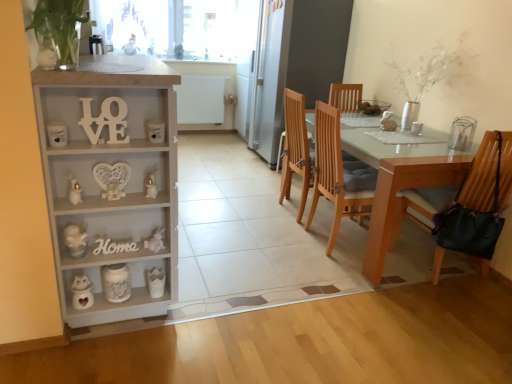
I want to click on leather-like black bag at right, the first chair viewed from the front, so click(405, 200).

Locate an element on the screen. This screenshot has height=384, width=512. wooden sign at lower left, the 1th number from the back is located at coordinates (114, 246).

In order to face white glass vase at upper right, should I rotate leftwards or rightwards?

Rotate your view right by about 20.714°.

This screenshot has height=384, width=512. I want to click on white wood love at left, which ranks as the first number in front-to-back order, so click(x=105, y=120).

You are a GUI agent. You are given a task and a screenshot of the screen. Output one action in this format:
    pyautogui.click(x=<x>, y=<y>)
    Task: Click on the leather-like black bag at right, which ranks as the 1th chair in right-to-left order
    
    Given the screenshot: What is the action you would take?
    pyautogui.click(x=405, y=200)

Looking at this image, how different are the orientations of transparent glass window screen at upper center and light brown wood chair at center, placed as the second chair when sorted from right to left, in degrees?

transparent glass window screen at upper center and light brown wood chair at center, placed as the second chair when sorted from right to left, are facing 91.1 degrees away from each other.

You are a GUI agent. You are given a task and a screenshot of the screen. Output one action in this format:
    pyautogui.click(x=<x>, y=<y>)
    Task: Click on the window screen behind the light brown wood chair at center, placed as the second chair when sorted from right to left
    
    Given the screenshot: What is the action you would take?
    pyautogui.click(x=176, y=26)

From the image's perspective, which one is positioned higher, transparent glass window screen at upper center or light brown wood chair at center, placed as the second chair when sorted from right to left?

transparent glass window screen at upper center is shown above in the image.

Considering the sizes of objects transparent glass window screen at upper center and light brown wood chair at center, placed as the second chair when sorted from right to left, in the image provided, who is wider, transparent glass window screen at upper center or light brown wood chair at center, placed as the second chair when sorted from right to left,?

light brown wood chair at center, placed as the second chair when sorted from right to left.

Does white glass vase at upper right appear on the left side of transparent glass window screen at upper center?

Incorrect, white glass vase at upper right is not on the left side of transparent glass window screen at upper center.

Considering the relative sizes of white glass vase at upper right and transparent glass window screen at upper center in the image provided, is white glass vase at upper right thinner than transparent glass window screen at upper center?

In fact, white glass vase at upper right might be wider than transparent glass window screen at upper center.

Does white glass vase at upper right lie in front of transparent glass window screen at upper center?

Yes, the depth of white glass vase at upper right is less than that of transparent glass window screen at upper center.

Can you see white glass vase at upper right touching transparent glass window screen at upper center?

There is a gap between white glass vase at upper right and transparent glass window screen at upper center.

Is white wood love at left, which appears as the 2th number when ordered from the bottom, next to transparent glass window screen at upper center and touching it?

No.

Looking at this image, does white wood love at left, which ranks as the first number in front-to-back order, lie behind transparent glass window screen at upper center?

No, white wood love at left, which ranks as the first number in front-to-back order, is closer to the viewer.

From a real-world perspective, which is physically above, white wood love at left, the second number viewed from the back, or transparent glass window screen at upper center?

transparent glass window screen at upper center, from a real-world perspective.

Based on their positions, is white wood love at left, which ranks as the first number in front-to-back order, located to the left or right of transparent glass window screen at upper center?

Based on their positions, white wood love at left, which ranks as the first number in front-to-back order, is located to the right of transparent glass window screen at upper center.

Can you confirm if white wood love at left, which appears as the 2th number when ordered from the bottom, is bigger than light brown wood chair at center, acting as the 1th chair starting from the back?

Incorrect, white wood love at left, which appears as the 2th number when ordered from the bottom, is not larger than light brown wood chair at center, acting as the 1th chair starting from the back.

Is white wood love at left, which ranks as the first number in front-to-back order, positioned beyond the bounds of light brown wood chair at center, acting as the 1th chair starting from the back?

That's correct, white wood love at left, which ranks as the first number in front-to-back order, is outside of light brown wood chair at center, acting as the 1th chair starting from the back.

In the scene shown: Considering the sizes of white wood love at left, which ranks as the first number in front-to-back order, and light brown wood chair at center, acting as the 1th chair starting from the left, in the image, is white wood love at left, which ranks as the first number in front-to-back order, taller or shorter than light brown wood chair at center, acting as the 1th chair starting from the left,?

Considering their sizes, white wood love at left, which ranks as the first number in front-to-back order, has less height than light brown wood chair at center, acting as the 1th chair starting from the left.

Could you tell me if white glass vase at upper right is turned towards white wood love at left, the second number viewed from the back?

Yes, white glass vase at upper right is turned towards white wood love at left, the second number viewed from the back.

Considering the sizes of objects white glass vase at upper right and white wood love at left, which ranks as the first number in front-to-back order, in the image provided, who is taller, white glass vase at upper right or white wood love at left, which ranks as the first number in front-to-back order,?

white glass vase at upper right.

From the image's perspective, is white glass vase at upper right above white wood love at left, which ranks as the first number in front-to-back order?

Yes, from the image's perspective, white glass vase at upper right is on top of white wood love at left, which ranks as the first number in front-to-back order.

Considering the sizes of objects wooden sign at lower left, acting as the 2th number starting from the top, and light brown wood chair at center, acting as the 1th chair starting from the back, in the image provided, who is taller, wooden sign at lower left, acting as the 2th number starting from the top, or light brown wood chair at center, acting as the 1th chair starting from the back,?

light brown wood chair at center, acting as the 1th chair starting from the back, is taller.

What are the coordinates of `number below the light brown wood chair at center, positioned as the second chair in front-to-back order (from the image's perspective)` in the screenshot? It's located at (114, 246).

In the scene shown: Can you tell me how much wooden sign at lower left, the second number viewed from the front, and light brown wood chair at center, placed as the second chair when sorted from right to left, differ in facing direction?

The angular difference between wooden sign at lower left, the second number viewed from the front, and light brown wood chair at center, placed as the second chair when sorted from right to left, is 89.9 degrees.

There is a white wood cabinet at left. At what (x,y) coordinates should I click in order to perform the action: click on the 2nd chair below it (from a real-world perspective). Please return your answer as a coordinate pair (x, y). The width and height of the screenshot is (512, 384). Looking at the image, I should click on (405, 200).

Is leather-like black bag at right, the 2th chair in the left-to-right sequence, inside white wood cabinet at left?

No, leather-like black bag at right, the 2th chair in the left-to-right sequence, is located outside of white wood cabinet at left.

Looking at this image, from a real-world perspective, between white wood cabinet at left and leather-like black bag at right, which is counted as the 2th chair, starting from the back, who is vertically lower?

From a 3D spatial view, leather-like black bag at right, which is counted as the 2th chair, starting from the back, is below.

Image resolution: width=512 pixels, height=384 pixels. I want to click on the 1st chair in front of the transparent glass window screen at upper center, so click(294, 148).

At what (x,y) coordinates should I click in order to perform the action: click on plant beneath the transparent glass window screen at upper center (from a real-world perspective). Please return your answer as a coordinate pair (x, y). Image resolution: width=512 pixels, height=384 pixels. Looking at the image, I should click on (429, 71).

Looking at the image, which one is located further to leather-like black bag at right, the first chair viewed from the front, white wood love at left, which is the first number from top to bottom, or white glass vase at upper right?

white wood love at left, which is the first number from top to bottom, is further to leather-like black bag at right, the first chair viewed from the front.

Estimate the real-world distances between objects in this image. Which object is closer to transparent glass window screen at upper center, leather-like black bag at right, which ranks as the 1th chair in right-to-left order, or white glass vase at upper right?

Among the two, white glass vase at upper right is located nearer to transparent glass window screen at upper center.

Estimate the real-world distances between objects in this image. Which object is closer to white wood cabinet at left, light brown wood chair at center, acting as the 1th chair starting from the back, or white wood love at left, which ranks as the first number in front-to-back order?

white wood love at left, which ranks as the first number in front-to-back order.

Looking at the image, which one is located closer to wooden sign at lower left, arranged as the 1th number when ordered from the bottom, light brown wood chair at center, placed as the second chair when sorted from right to left, or white glass vase at upper right?

The object closer to wooden sign at lower left, arranged as the 1th number when ordered from the bottom, is light brown wood chair at center, placed as the second chair when sorted from right to left.

Considering their positions, is white glass vase at upper right positioned further to transparent glass window screen at upper center than wooden sign at lower left, the 1th number from the back?

wooden sign at lower left, the 1th number from the back, lies further to transparent glass window screen at upper center than the other object.

Based on their spatial positions, is white wood love at left, which ranks as the first number in front-to-back order, or white wood cabinet at left further from white glass vase at upper right?

white wood love at left, which ranks as the first number in front-to-back order.

From the image, which object appears to be farther from white wood love at left, the second number viewed from the back, white glass vase at upper right or white wood cabinet at left?

white glass vase at upper right is positioned further to the anchor white wood love at left, the second number viewed from the back.

Based on their spatial positions, is white wood love at left, which is the first number from top to bottom, or transparent glass window screen at upper center further from wooden sign at lower left, acting as the 2th number starting from the top?

The object further to wooden sign at lower left, acting as the 2th number starting from the top, is transparent glass window screen at upper center.

Locate an element on the screen. The width and height of the screenshot is (512, 384). plant located between wooden sign at lower left, the second number viewed from the front, and transparent glass window screen at upper center in the depth direction is located at coordinates (429, 71).

Where is `chair between wooden sign at lower left, acting as the 2th number starting from the top, and white glass vase at upper right from left to right`? chair between wooden sign at lower left, acting as the 2th number starting from the top, and white glass vase at upper right from left to right is located at coordinates (294, 148).

The width and height of the screenshot is (512, 384). I want to click on chair situated between white wood cabinet at left and leather-like black bag at right, which is counted as the 2th chair, starting from the back, from left to right, so click(x=294, y=148).

Where is `cabinetry between white wood love at left, which ranks as the first number in front-to-back order, and wooden sign at lower left, acting as the 2th number starting from the top, in the up-down direction`? cabinetry between white wood love at left, which ranks as the first number in front-to-back order, and wooden sign at lower left, acting as the 2th number starting from the top, in the up-down direction is located at coordinates (110, 178).